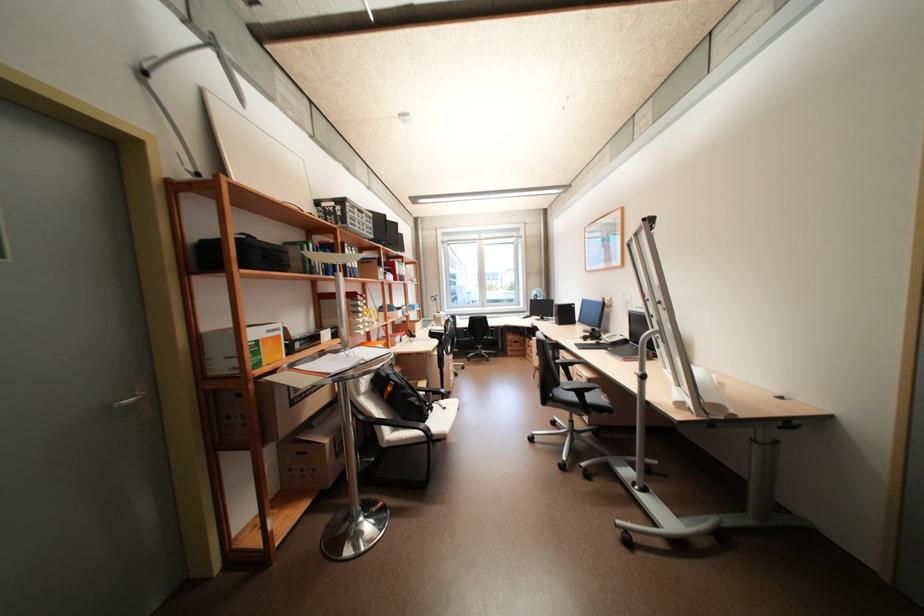
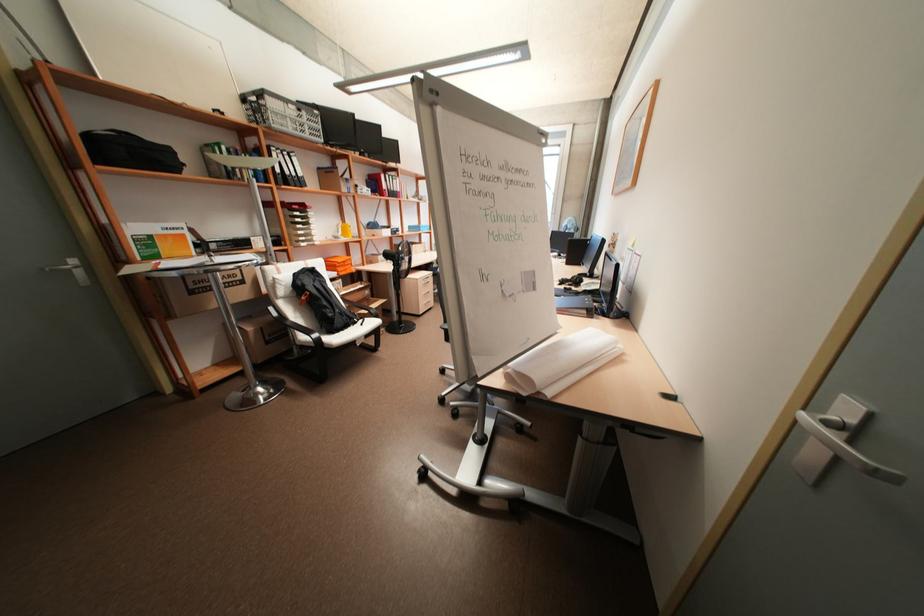
Find the pixel in the second image that matches (262,341) in the first image.

(155, 236)